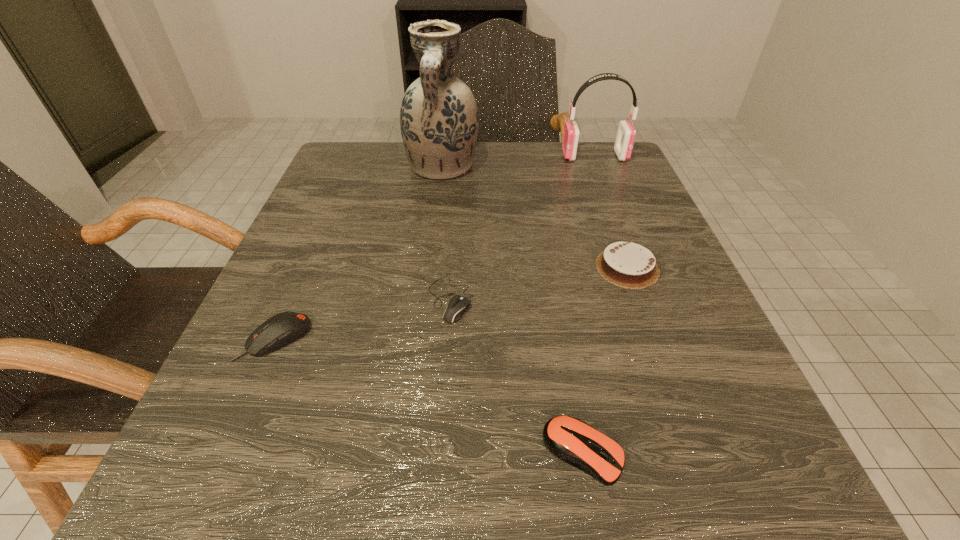
This screenshot has width=960, height=540. I want to click on free spot between the chocolate cake and the vase, so click(535, 218).

This screenshot has height=540, width=960. What are the coordinates of `vacant space that's between the shortest computer mouse and the fourth object from left to right` in the screenshot? It's located at (516, 376).

This screenshot has width=960, height=540. I want to click on free space that is in between the vase and the chocolate cake, so click(535, 218).

Where is `empty space that is in between the fifth shortest object and the vase`? empty space that is in between the fifth shortest object and the vase is located at coordinates (518, 162).

The image size is (960, 540). In order to click on free spot between the tallest object and the chocolate cake in this screenshot , I will do `click(535, 218)`.

Where is `empty space that is in between the second tallest computer mouse and the tallest object`? Image resolution: width=960 pixels, height=540 pixels. empty space that is in between the second tallest computer mouse and the tallest object is located at coordinates (513, 310).

Find the location of a particular element. This screenshot has width=960, height=540. vacant space in between the leftmost object and the rightmost computer mouse is located at coordinates (429, 395).

This screenshot has width=960, height=540. What are the coordinates of `vacant region between the chocolate cake and the shortest object` in the screenshot? It's located at (539, 284).

I want to click on free spot between the earphone and the shortest computer mouse, so click(522, 228).

Find the location of a particular element. This screenshot has height=540, width=960. object that stands as the fifth closest to the shortest object is located at coordinates (626, 133).